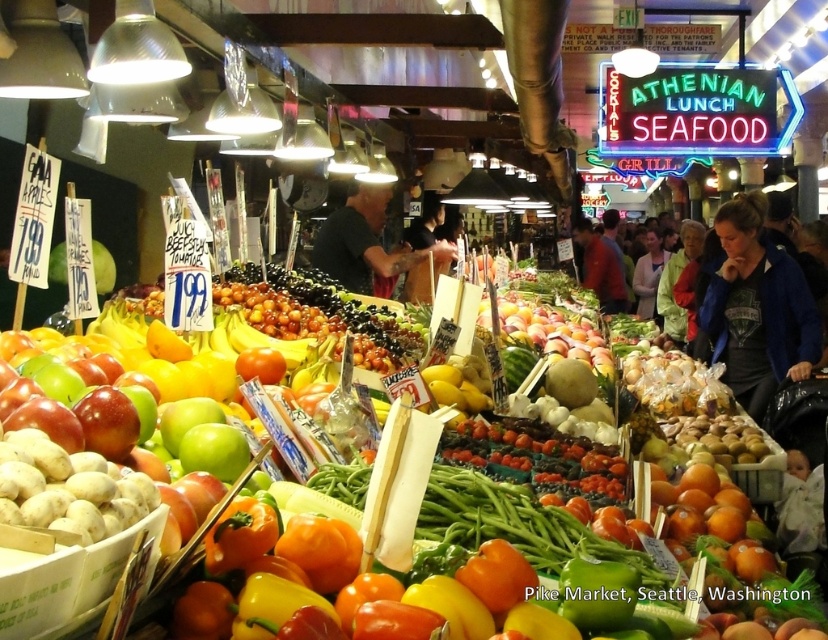
Is black shirt at center smaller than red shirt at center?

Correct, black shirt at center occupies less space than red shirt at center.

Which is below, black shirt at center or red shirt at center?

black shirt at center is below.

Which is behind, point (360, 220) or point (602, 276)?

The point (602, 276) is more distant.

Image resolution: width=828 pixels, height=640 pixels. In order to click on black shirt at center in this screenshot , I will do `click(366, 243)`.

Can you confirm if blue fabric jacket at right is positioned to the right of black shirt at center?

Yes, blue fabric jacket at right is to the right of black shirt at center.

Is blue fabric jacket at right further to camera compared to black shirt at center?

No, blue fabric jacket at right is closer to the viewer.

Where is `blue fabric jacket at right`? Image resolution: width=828 pixels, height=640 pixels. blue fabric jacket at right is located at coordinates (756, 307).

In order to click on blue fabric jacket at right in this screenshot , I will do `click(756, 307)`.

Does point (754, 289) come closer to viewer compared to point (602, 252)?

Yes, it is.

You are a GUI agent. You are given a task and a screenshot of the screen. Output one action in this format:
    pyautogui.click(x=<x>, y=<y>)
    Task: Click on the blue fabric jacket at right
    
    Given the screenshot: What is the action you would take?
    pyautogui.click(x=756, y=307)